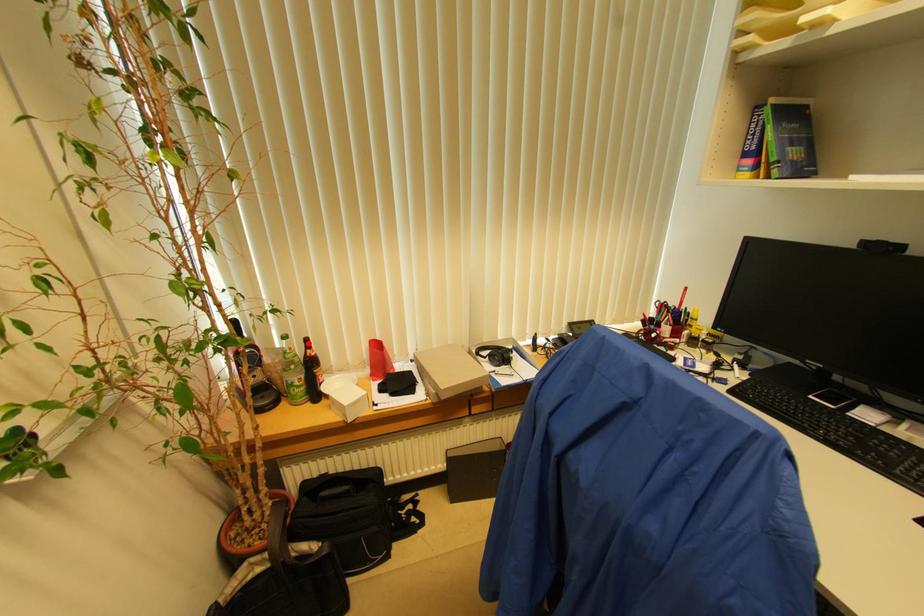
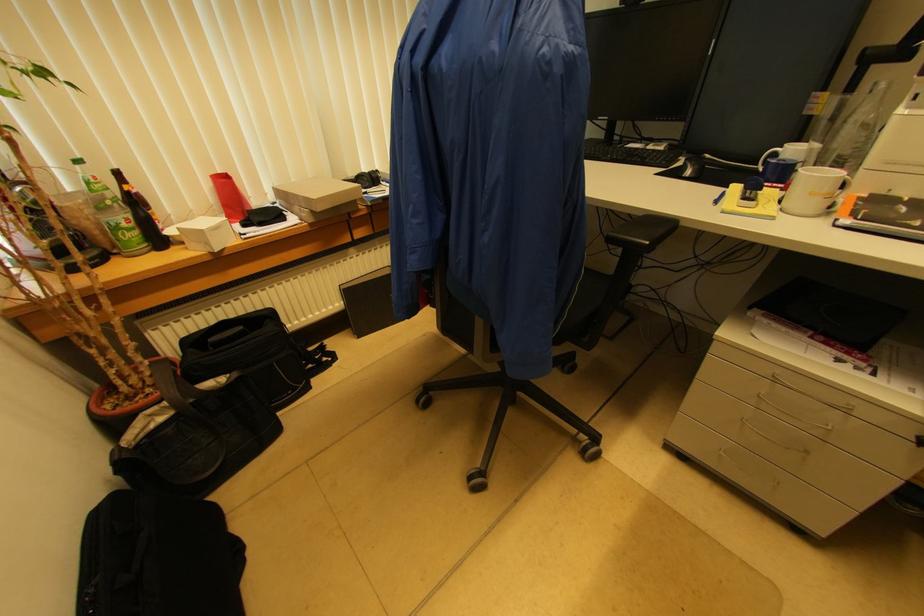
Question: I am providing you with two images of the same scene from different viewpoints. Image1 has a red point marked. In image2, the corresponding 3D location appears at what relative position? Reply with the corresponding letter.

Choices:
 (A) Closer
 (B) Farther

Answer: (B)